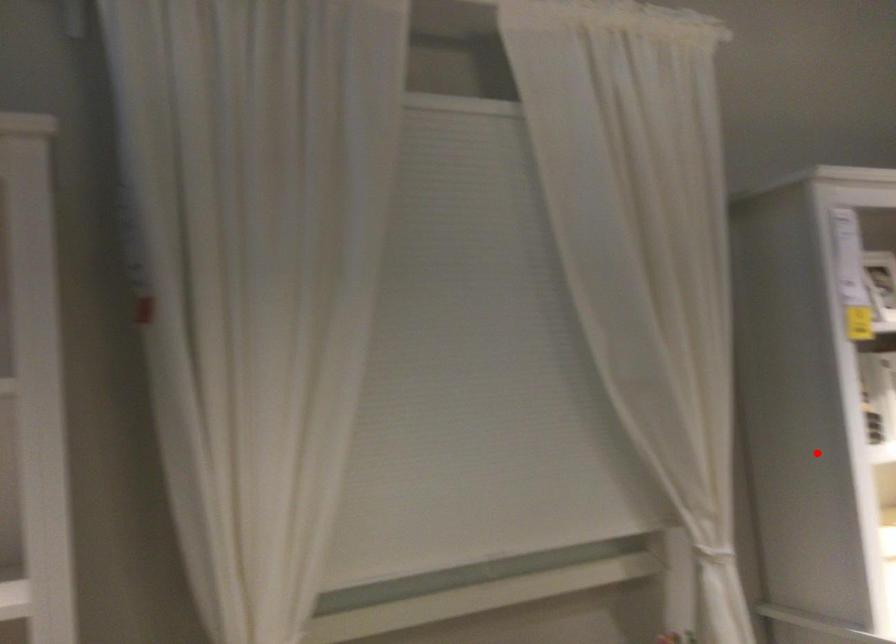
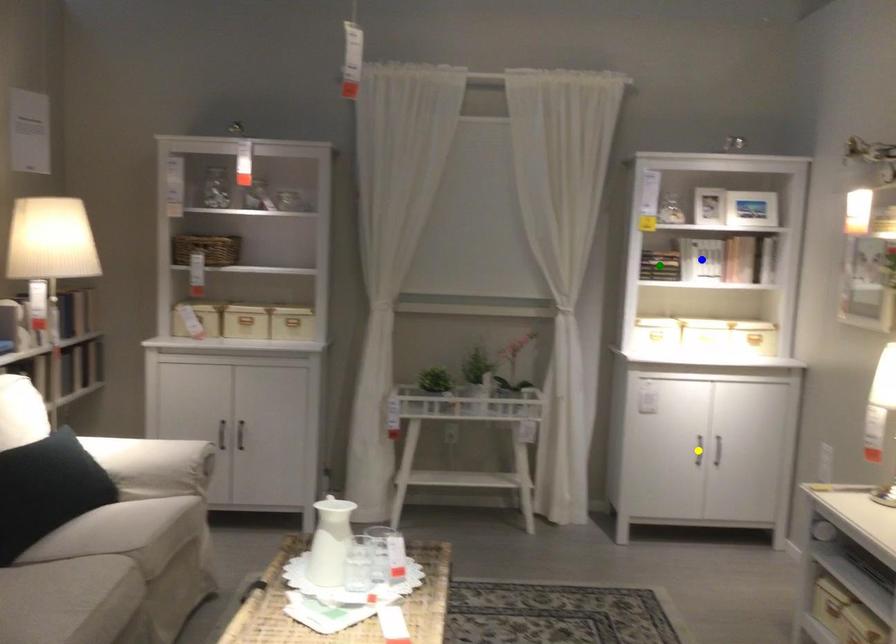
Question: I am providing you with two images of the same scene from different viewpoints. A red point is marked on the first image. You are given multiple points on the second image. Can you choose the point in image 2 that corresponds to the point in image 1?

Choices:
 (A) yellow point
 (B) blue point
 (C) green point

Answer: (C)